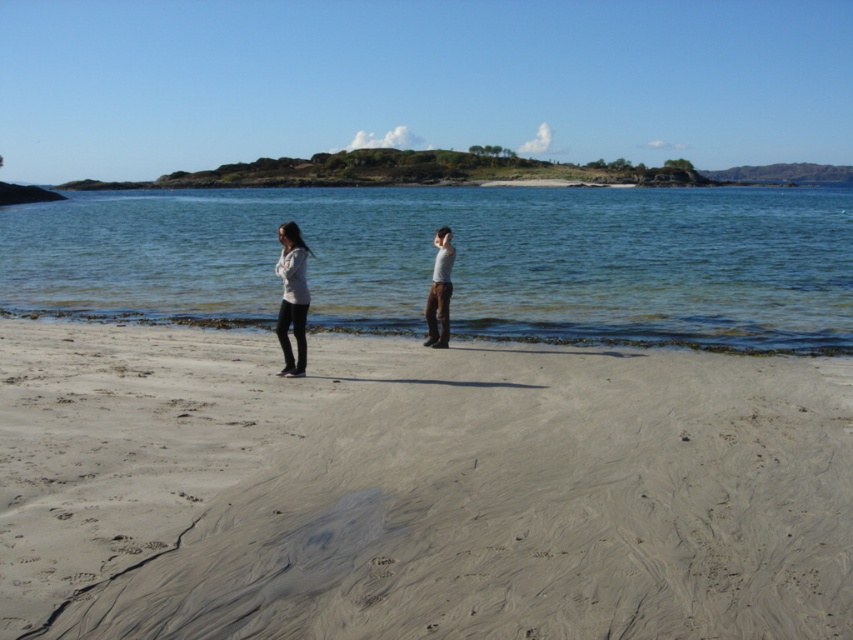
You are standing on the beach and want to place a small bucket exactly where the smooth sand at center and clear water at center meet. According to the scene description, where should you position the bucket?

The smooth sand at center is to the right of clear water at center, so you should place the bucket at the boundary between them, aligning it with the right edge of the clear water at center and the left edge of the smooth sand at center.

You are planning to place the matte gray sweater at center on the smooth sand at center. Considering the size of both, will the sweater fit entirely on the sand without overlapping the edges?

The smooth sand at center has a larger width than the matte gray sweater at center, so the sweater will fit entirely on the sand without overlapping the edges.